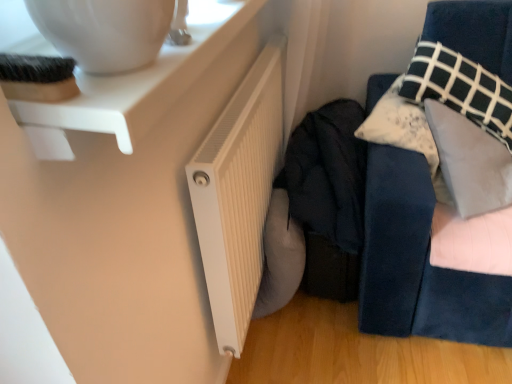
Question: Looking at their shapes, would you say white ribbed radiator at lower center is wider or thinner than dark fabric jacket at center?

Choices:
 (A) thin
 (B) wide

Answer: (A)

Question: From their relative heights in the image, would you say white ribbed radiator at lower center is taller or shorter than dark fabric jacket at center?

Choices:
 (A) tall
 (B) short

Answer: (A)

Question: Which object is the farthest from the dark fabric jacket at center?

Choices:
 (A) velvet blue sofa at right
 (B) white ribbed radiator at lower center
 (C) white plastic table at upper left

Answer: (C)

Question: Considering the real-world distances, which object is farthest from the white ribbed radiator at lower center?

Choices:
 (A) velvet blue sofa at right
 (B) dark fabric jacket at center
 (C) white plastic table at upper left

Answer: (C)